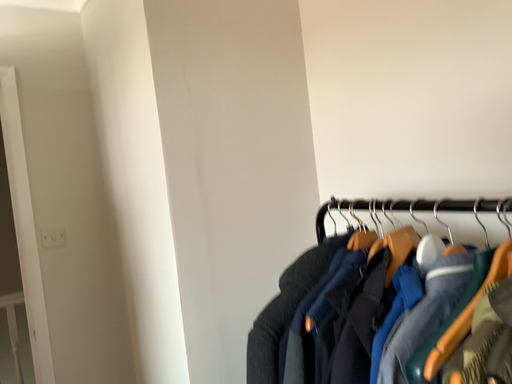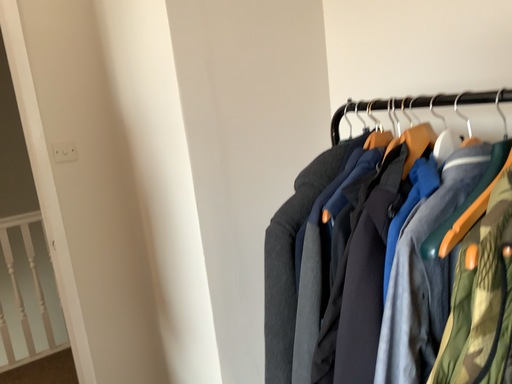
Question: How did the camera likely rotate when shooting the video?

Choices:
 (A) rotated upward
 (B) rotated downward

Answer: (B)